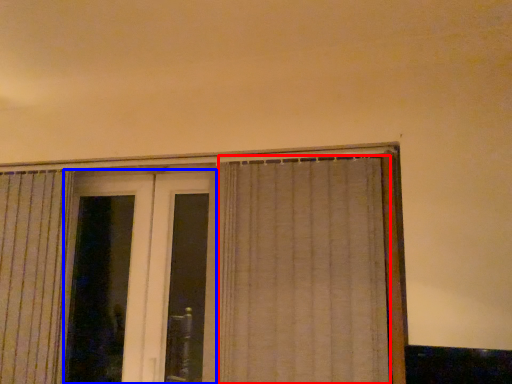
Question: Which object appears closest to the camera in this image, curtain (highlighted by a red box) or screen door (highlighted by a blue box)?

Choices:
 (A) curtain
 (B) screen door

Answer: (A)